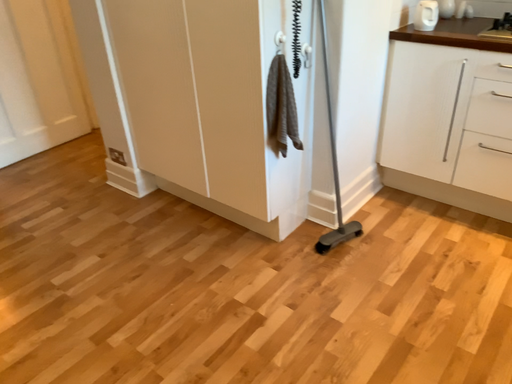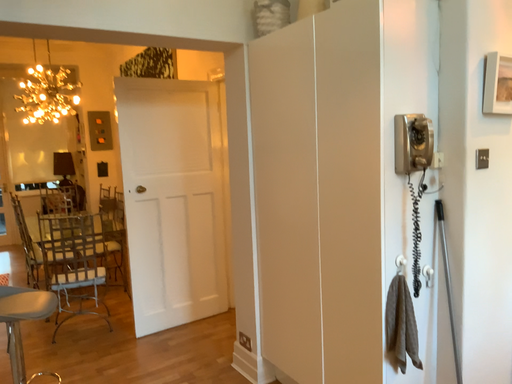
Question: How did the camera likely rotate when shooting the video?

Choices:
 (A) rotated right
 (B) rotated left

Answer: (B)